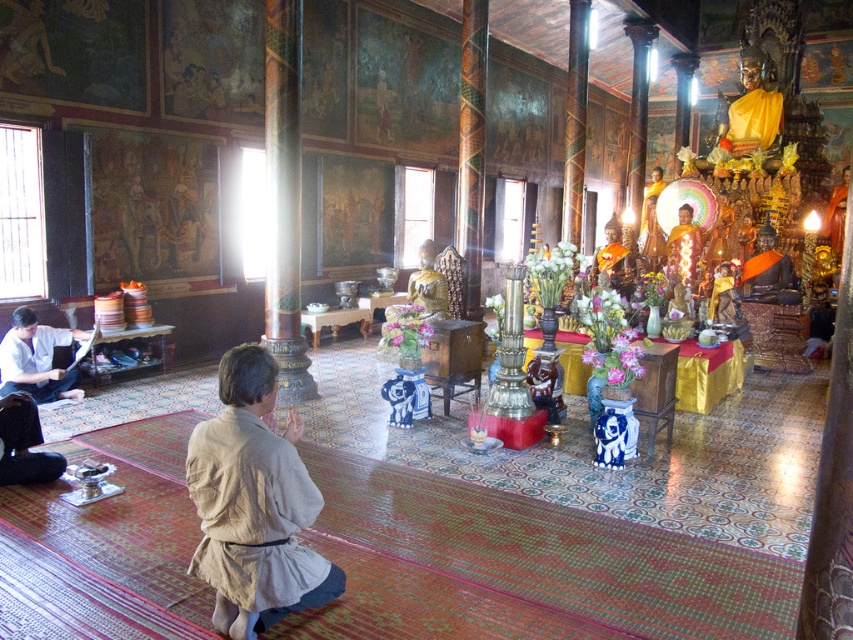
Who is positioned more to the left, beige linen robe at lower center or white paper at left?

Positioned to the left is white paper at left.

Which is below, beige linen robe at lower center or white paper at left?

beige linen robe at lower center

Identify the location of beige linen robe at lower center. (254, 524).